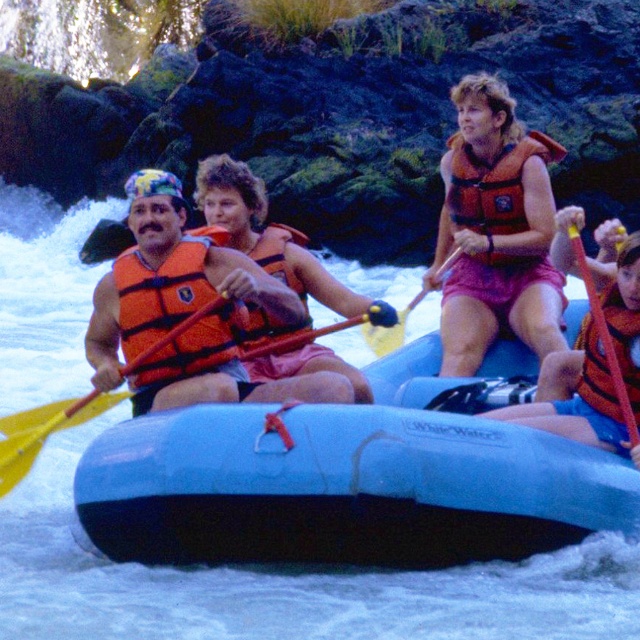
Which of these two, orange life vest at right or rubber paddle at right, stands taller?

With more height is orange life vest at right.

Where is `orange life vest at right`? Image resolution: width=640 pixels, height=640 pixels. orange life vest at right is located at coordinates (580, 404).

Which is in front, point (509, 412) or point (636, 424)?

Point (636, 424)

In order to click on orange life vest at right in this screenshot , I will do `click(580, 404)`.

Does orange life vest at upper center have a larger size compared to orange life jacket at upper center?

Yes.

Is orange life vest at upper center wider than orange life jacket at upper center?

Yes.

You are a GUI agent. You are given a task and a screenshot of the screen. Output one action in this format:
    pyautogui.click(x=<x>, y=<y>)
    Task: Click on the orange life vest at upper center
    
    Given the screenshot: What is the action you would take?
    pyautogui.click(x=496, y=230)

Who is higher up, blue rubber boat at center or orange life vest at right?

orange life vest at right is above.

Does blue rubber boat at center have a larger size compared to orange life vest at right?

Actually, blue rubber boat at center might be smaller than orange life vest at right.

Who is more distant from viewer, (x=630, y=508) or (x=609, y=300)?

Point (x=609, y=300)

Where is `blue rubber boat at center`? The width and height of the screenshot is (640, 640). blue rubber boat at center is located at coordinates (342, 488).